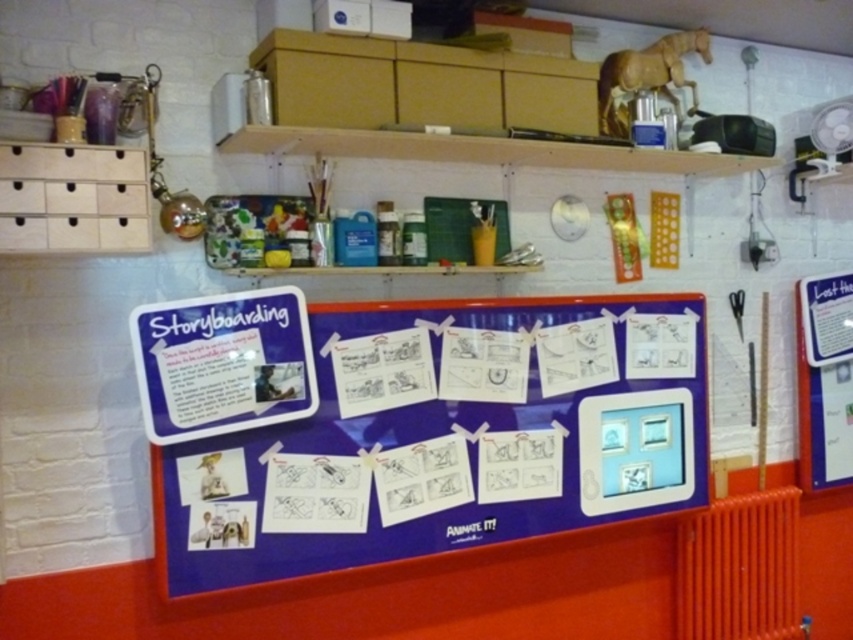
Question: Among these points, which one is nearest to the camera?

Choices:
 (A) (747, 596)
 (B) (567, 308)

Answer: (B)

Question: Is blue fabric storyboard at center closer to camera compared to orange metallic radiator at lower right?

Choices:
 (A) no
 (B) yes

Answer: (B)

Question: Can you confirm if blue fabric storyboard at center is bigger than orange metallic radiator at lower right?

Choices:
 (A) no
 (B) yes

Answer: (B)

Question: Is blue fabric storyboard at center below orange metallic radiator at lower right?

Choices:
 (A) no
 (B) yes

Answer: (A)